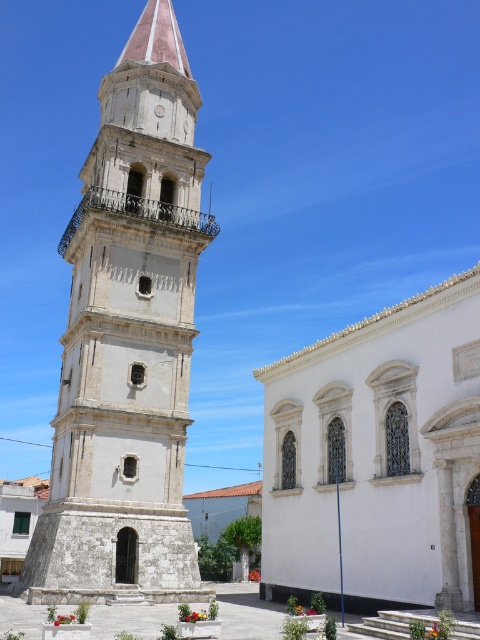
Does point (88, 390) come behind point (457, 605)?

Yes.

The width and height of the screenshot is (480, 640). Describe the element at coordinates (128, 340) in the screenshot. I see `white stone tower at center` at that location.

Locate an element on the screen. white stone tower at center is located at coordinates (128, 340).